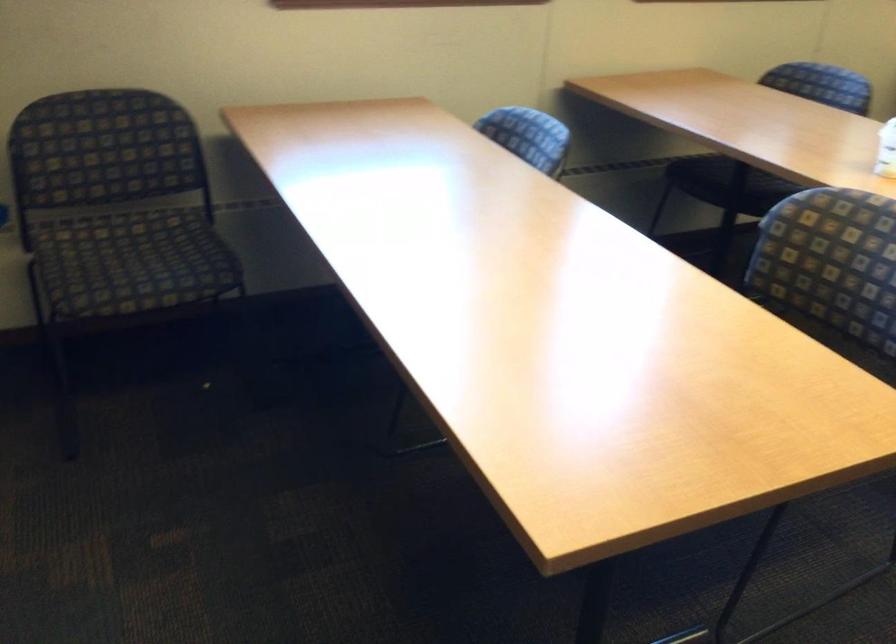
Find the location of a particular element. Image resolution: width=896 pixels, height=644 pixels. chair sitting surface is located at coordinates (131, 261).